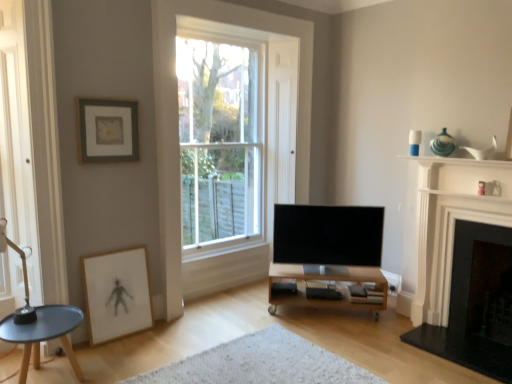
Question: Is clear glass window at center positioned before matte gray picture frame at upper left, marked as the second picture frame in a bottom-to-top arrangement?

Choices:
 (A) yes
 (B) no

Answer: (B)

Question: From the image's perspective, is clear glass window at center located beneath matte gray picture frame at upper left, placed as the first picture frame when sorted from top to bottom?

Choices:
 (A) yes
 (B) no

Answer: (A)

Question: Considering the relative sizes of clear glass window at center and matte gray picture frame at upper left, placed as the first picture frame when sorted from top to bottom, in the image provided, is clear glass window at center taller than matte gray picture frame at upper left, placed as the first picture frame when sorted from top to bottom,?

Choices:
 (A) yes
 (B) no

Answer: (A)

Question: Considering the relative sizes of clear glass window at center and matte gray picture frame at upper left, marked as the second picture frame in a bottom-to-top arrangement, in the image provided, is clear glass window at center thinner than matte gray picture frame at upper left, marked as the second picture frame in a bottom-to-top arrangement,?

Choices:
 (A) no
 (B) yes

Answer: (A)

Question: Could you tell me if clear glass window at center is turned towards matte gray picture frame at upper left, marked as the second picture frame in a bottom-to-top arrangement?

Choices:
 (A) no
 (B) yes

Answer: (A)

Question: Is clear glass window at center positioned with its back to matte gray picture frame at upper left, placed as the first picture frame when sorted from top to bottom?

Choices:
 (A) no
 (B) yes

Answer: (A)

Question: Is matte gray picture frame at upper left, marked as the second picture frame in a bottom-to-top arrangement, turned away from black matte speaker at lower center?

Choices:
 (A) no
 (B) yes

Answer: (A)

Question: Considering the relative sizes of matte gray picture frame at upper left, marked as the second picture frame in a bottom-to-top arrangement, and black matte speaker at lower center in the image provided, is matte gray picture frame at upper left, marked as the second picture frame in a bottom-to-top arrangement, thinner than black matte speaker at lower center?

Choices:
 (A) no
 (B) yes

Answer: (B)

Question: Can you confirm if matte gray picture frame at upper left, placed as the first picture frame when sorted from top to bottom, is wider than black matte speaker at lower center?

Choices:
 (A) yes
 (B) no

Answer: (B)

Question: Does matte gray picture frame at upper left, marked as the second picture frame in a bottom-to-top arrangement, appear on the right side of black matte speaker at lower center?

Choices:
 (A) yes
 (B) no

Answer: (B)

Question: Is the position of matte gray picture frame at upper left, marked as the second picture frame in a bottom-to-top arrangement, more distant than that of black matte speaker at lower center?

Choices:
 (A) no
 (B) yes

Answer: (A)

Question: Is black matte speaker at lower center inside matte gray picture frame at upper left, marked as the second picture frame in a bottom-to-top arrangement?

Choices:
 (A) no
 (B) yes

Answer: (A)

Question: Does white marble fireplace at right, which is the 1th fireplace from left to right, turn towards flat screen tv at center?

Choices:
 (A) no
 (B) yes

Answer: (A)